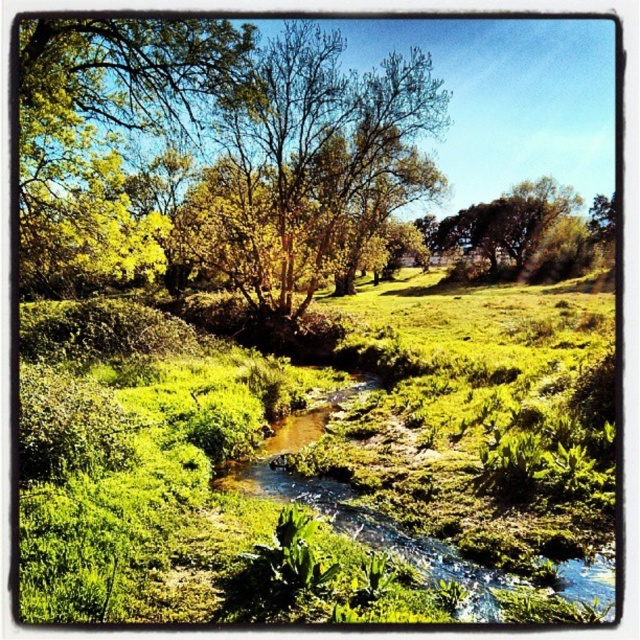
Between green leafy tree at center and green leafy tree at upper left, which one appears on the right side from the viewer's perspective?

green leafy tree at center

Which is below, green leafy tree at center or green leafy tree at upper left?

Positioned lower is green leafy tree at upper left.

Who is more forward, (442, 113) or (20, 218)?

Point (20, 218) is in front.

Find the location of `green leafy tree at center`. green leafy tree at center is located at coordinates (310, 164).

Is clear water stream at center smaller than green leafy tree at upper center?

Indeed, clear water stream at center has a smaller size compared to green leafy tree at upper center.

Does clear water stream at center have a greater width compared to green leafy tree at upper center?

In fact, clear water stream at center might be narrower than green leafy tree at upper center.

This screenshot has height=640, width=640. Describe the element at coordinates (358, 512) in the screenshot. I see `clear water stream at center` at that location.

I want to click on clear water stream at center, so click(x=358, y=512).

Is green leafy tree at upper left bigger than clear water stream at center?

→ Correct, green leafy tree at upper left is larger in size than clear water stream at center.

Who is taller, green leafy tree at upper left or clear water stream at center?

green leafy tree at upper left is taller.

Measure the distance between point (x=134, y=44) and camera.

They are 14.98 meters apart.

You are a GUI agent. You are given a task and a screenshot of the screen. Output one action in this format:
    pyautogui.click(x=<x>, y=<y>)
    Task: Click on the green leafy tree at upper left
    The width and height of the screenshot is (640, 640).
    Given the screenshot: What is the action you would take?
    pyautogui.click(x=106, y=136)